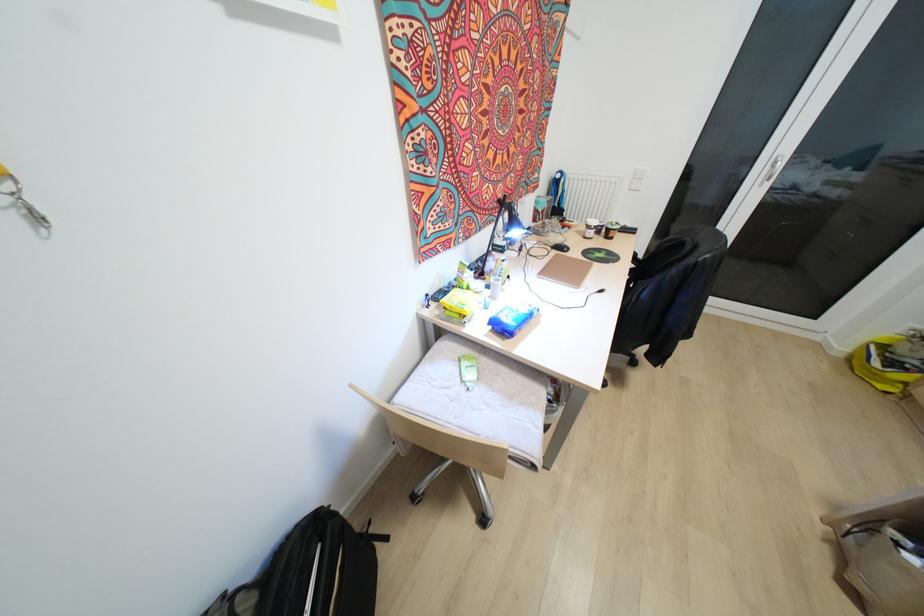
This screenshot has height=616, width=924. Describe the element at coordinates (540, 208) in the screenshot. I see `the small green bottle` at that location.